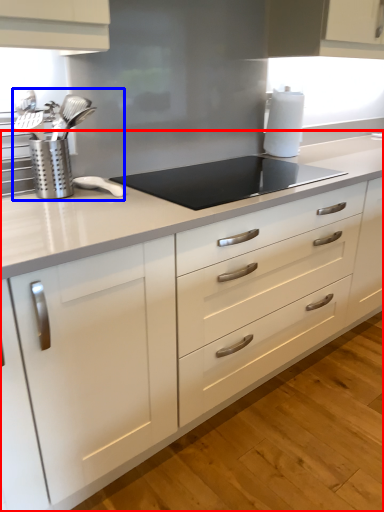
Question: Among these objects, which one is farthest to the camera, countertop (highlighted by a red box) or sink (highlighted by a blue box)?

Choices:
 (A) countertop
 (B) sink

Answer: (B)